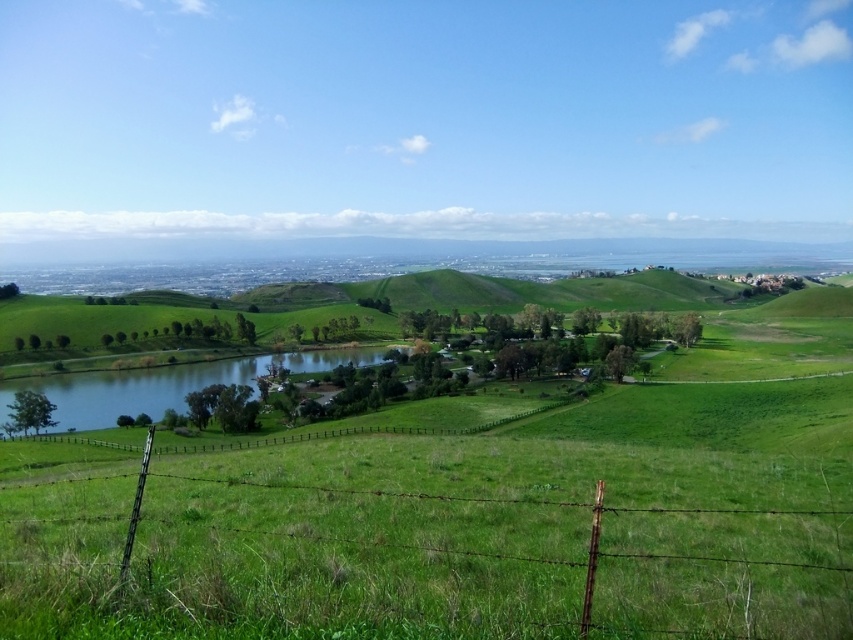
Who is lower down, green wire fence at lower center or green grassy lake at center?

Positioned lower is green grassy lake at center.

Where is `green wire fence at lower center`? This screenshot has width=853, height=640. green wire fence at lower center is located at coordinates (433, 544).

Locate an element on the screen. green wire fence at lower center is located at coordinates (433, 544).